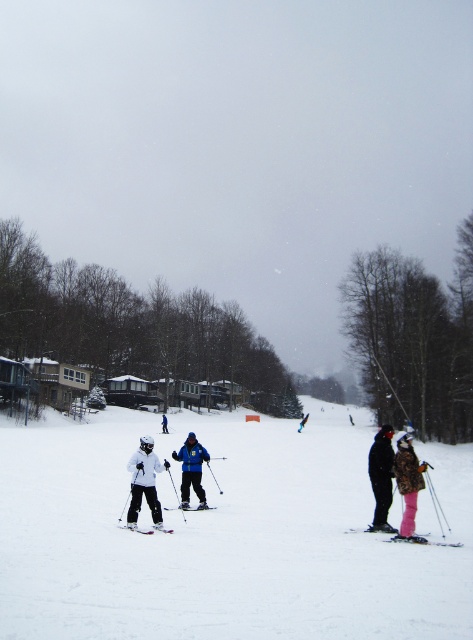
Can you confirm if camouflage jacket at center is thinner than matte black ski at lower center?

Indeed, camouflage jacket at center has a lesser width compared to matte black ski at lower center.

Where is `camouflage jacket at center`? Image resolution: width=473 pixels, height=640 pixels. camouflage jacket at center is located at coordinates (408, 483).

Identify the location of camouflage jacket at center. (408, 483).

Does blue matte jacket at center have a greater width compared to matte black ski at lower center?

No, blue matte jacket at center is not wider than matte black ski at lower center.

You are a GUI agent. You are given a task and a screenshot of the screen. Output one action in this format:
    pyautogui.click(x=<x>, y=<y>)
    Task: Click on the blue matte jacket at center
    The image size is (473, 640).
    Given the screenshot: What is the action you would take?
    pyautogui.click(x=192, y=468)

Can you confirm if blue matte jacket at center is smaller than matte black ski at center?

No, blue matte jacket at center is not smaller than matte black ski at center.

Consider the image. Measure the distance between blue matte jacket at center and camera.

A distance of 16.87 meters exists between blue matte jacket at center and camera.

Is point (183, 508) positioned in front of point (190, 508)?

Yes.

At what (x,y) coordinates should I click in order to perform the action: click on blue matte jacket at center. Please return your answer as a coordinate pair (x, y). Looking at the image, I should click on [x=192, y=468].